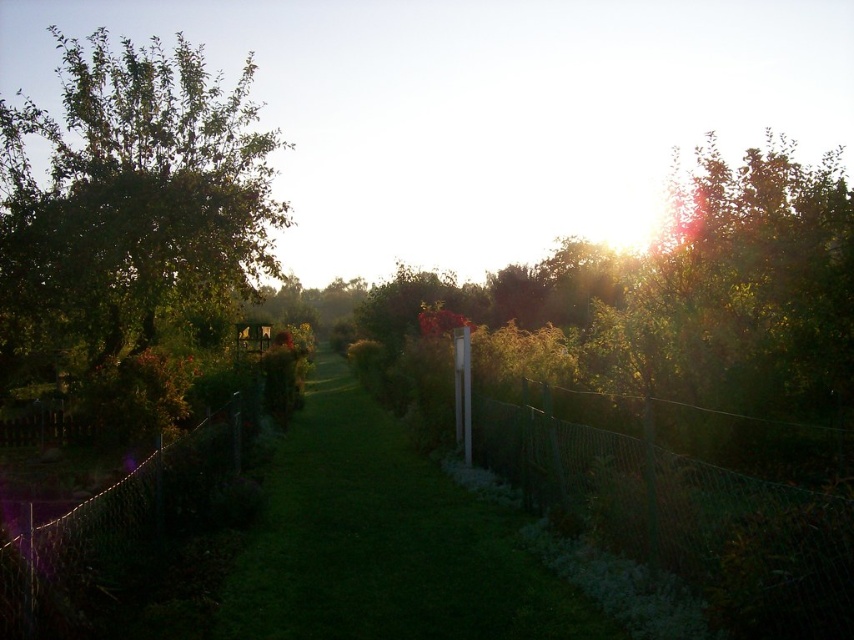
You are a gardener trying to mow the lawn. You have a lawnmower that is 1.2 meters wide. There is green grass at center and green wire mesh fence at right. Can your lawnmower fit between them without hitting the fence?

The green grass at center might be wider than green wire mesh fence at right, so the space between them could be sufficient for the lawnmower. However, since the exact width isn not specified, there is uncertainty. It might fit but requires careful maneuvering to avoid the fence.

You are a gardener planning to plant a new tree in this garden. The new tree will grow to be as tall as the green leafy tree at left. Considering the green wire mesh fence at right, will the new tree eventually grow taller than the fence?

The green leafy tree at left is much taller than the green wire mesh fence at right, so yes, the new tree will grow taller than the fence.